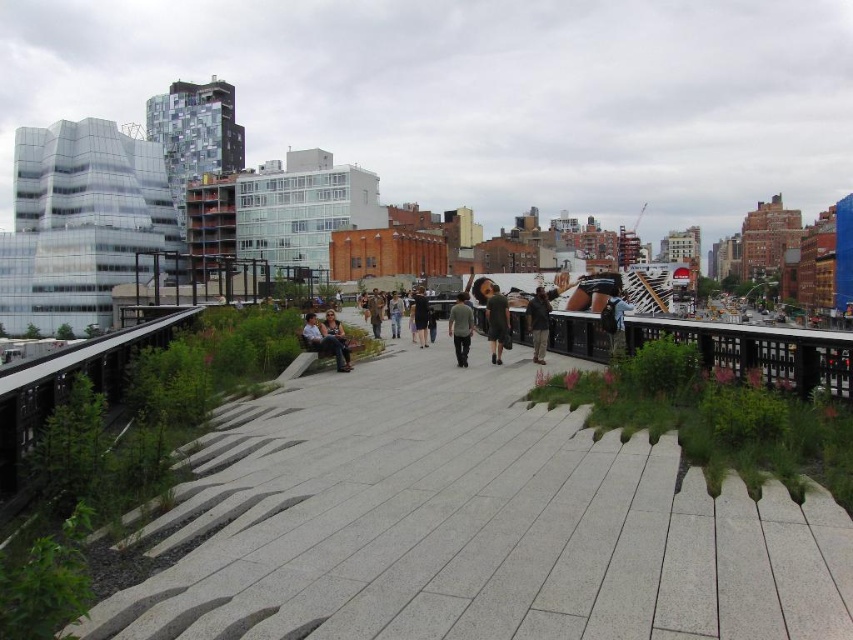
You are a photographer standing on the pathway and want to capture both the dark green dress at center and the denim pants at center in a single photo. Based on their positions, which clothing item will appear closer to the camera in the photo?

The dark green dress at center appears closer to the camera because it is positioned over the denim pants at center, indicating it is in front.

In the scene shown: You are a photographer trying to capture a person wearing dark gray pants at center and dark gray cotton shirt at center. Which part of their clothing would appear wider in the photo?

The dark gray pants at center would appear wider in the photo since their width is larger than the dark gray cotton shirt at center.